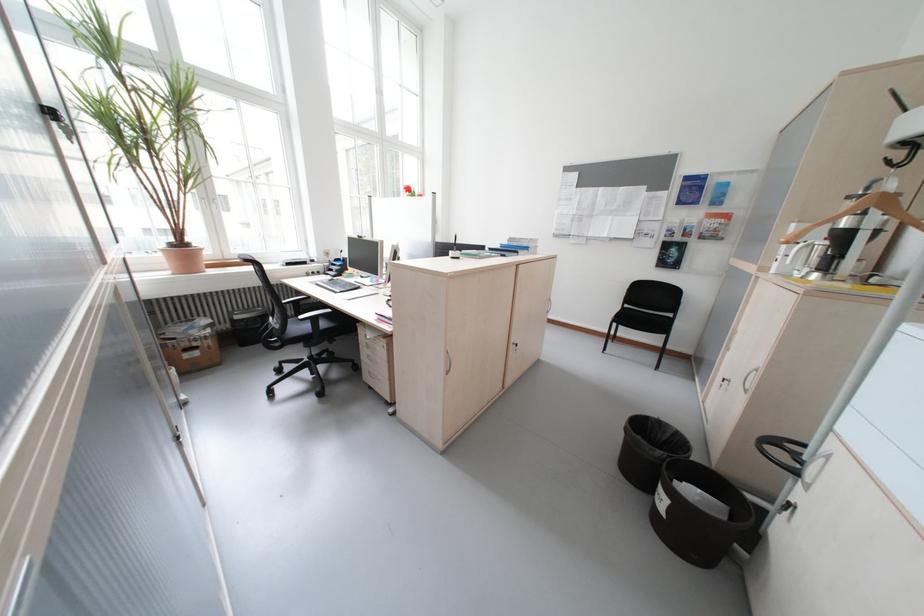
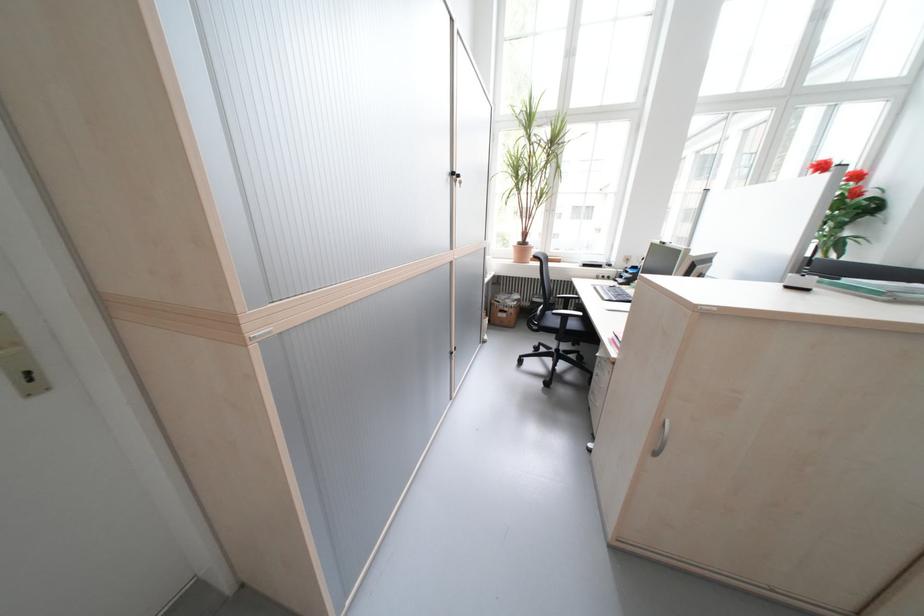
Find the pixel in the second image that matches [324,321] in the first image.

(575, 318)